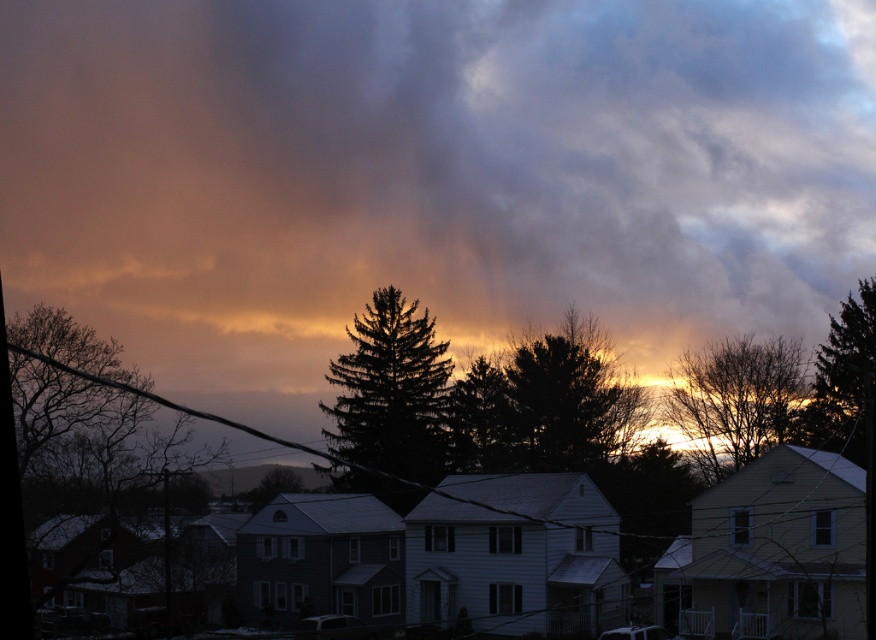
Question: Where is bare branches at upper center located in relation to green textured tree at center in the image?

Choices:
 (A) right
 (B) left

Answer: (A)

Question: Is dark gray cloud at upper center smaller than bare branches at upper center?

Choices:
 (A) yes
 (B) no

Answer: (B)

Question: Which object is closer to the camera taking this photo?

Choices:
 (A) bare branches at upper center
 (B) dark green textured tree at upper right
 (C) green textured tree at center
 (D) dark green textured tree at center

Answer: (B)

Question: Which point appears farthest from the camera in this image?

Choices:
 (A) (855, 358)
 (B) (502, 339)
 (C) (790, 358)
 (D) (429, 400)

Answer: (B)

Question: Which object is farther from the camera taking this photo?

Choices:
 (A) dark green textured tree at center
 (B) dark gray cloud at upper center
 (C) bare branches at upper center

Answer: (B)

Question: Is dark green textured tree at center above bare branches at upper center?

Choices:
 (A) no
 (B) yes

Answer: (A)